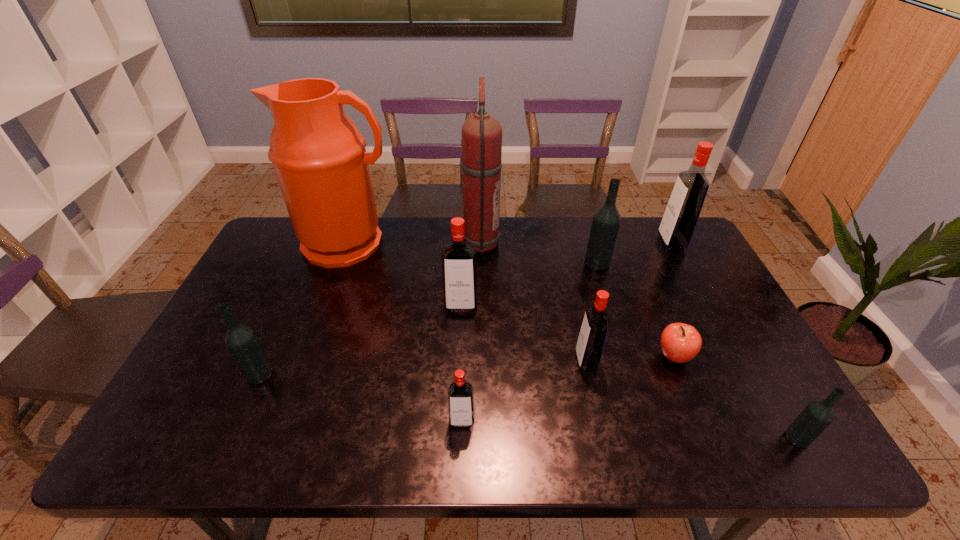
The image size is (960, 540). Find the location of `vodka that can be found as the sixth closest to the seventh object from left to right`. vodka that can be found as the sixth closest to the seventh object from left to right is located at coordinates (241, 340).

Locate an element on the screen. The height and width of the screenshot is (540, 960). red vodka that is the fourth closest to the leftmost black vodka is located at coordinates (682, 212).

You are a GUI agent. You are given a task and a screenshot of the screen. Output one action in this format:
    pyautogui.click(x=<x>, y=<y>)
    Task: Click on the fourth closest red vodka to the leftmost black vodka
    The image size is (960, 540).
    Given the screenshot: What is the action you would take?
    pyautogui.click(x=682, y=212)

In order to click on black vodka that is the second closest one to the second farthest black vodka in this screenshot , I will do `click(818, 415)`.

I want to click on black vodka that is the third closest to the third tallest object, so (241, 340).

Where is `blank area in the image that satisfies the following two spatial constraints: 1. on the front and back of the rightmost black vodka; 2. on the right side of the fourth vodka from right to left`? blank area in the image that satisfies the following two spatial constraints: 1. on the front and back of the rightmost black vodka; 2. on the right side of the fourth vodka from right to left is located at coordinates click(x=603, y=438).

Where is `vacant point that satisfies the following two spatial constraints: 1. on the front side of the fourth object from right to left; 2. on the left side of the smallest black vodka`? The height and width of the screenshot is (540, 960). vacant point that satisfies the following two spatial constraints: 1. on the front side of the fourth object from right to left; 2. on the left side of the smallest black vodka is located at coordinates (651, 438).

You are a GUI agent. You are given a task and a screenshot of the screen. Output one action in this format:
    pyautogui.click(x=<x>, y=<y>)
    Task: Click on the vacant region that satisfies the following two spatial constraints: 1. from the spout of the second black vodka from right to left; 2. on the right side of the water jug
    The width and height of the screenshot is (960, 540).
    Given the screenshot: What is the action you would take?
    pyautogui.click(x=342, y=262)